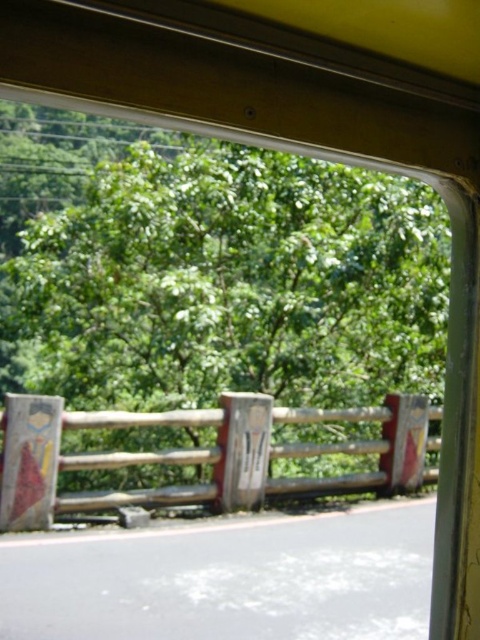
Is point (103, 392) closer to viewer compared to point (264, 406)?

Yes.

Can you confirm if green leafy tree at center is positioned to the left of wooden fence at lower center?

Indeed, green leafy tree at center is positioned on the left side of wooden fence at lower center.

Is point (313, 262) less distant than point (40, 472)?

No.

The height and width of the screenshot is (640, 480). I want to click on green leafy tree at center, so click(x=219, y=272).